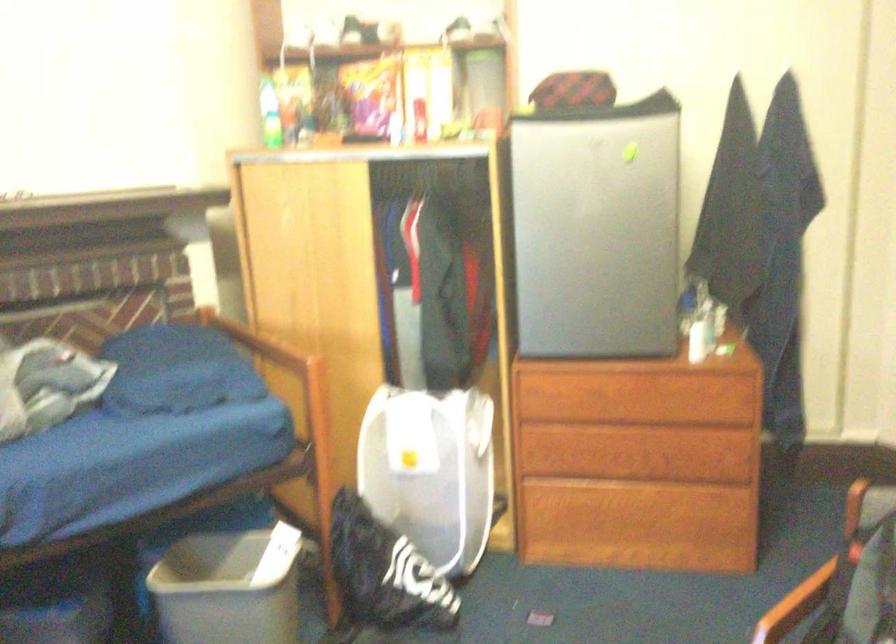
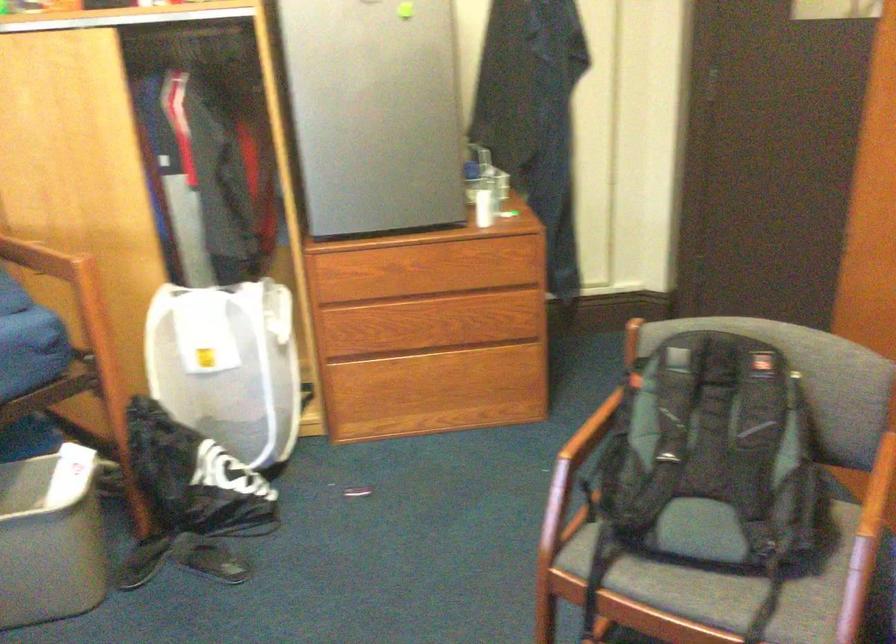
Locate, in the second image, the point that corresponds to point (702, 308) in the first image.

(485, 178)